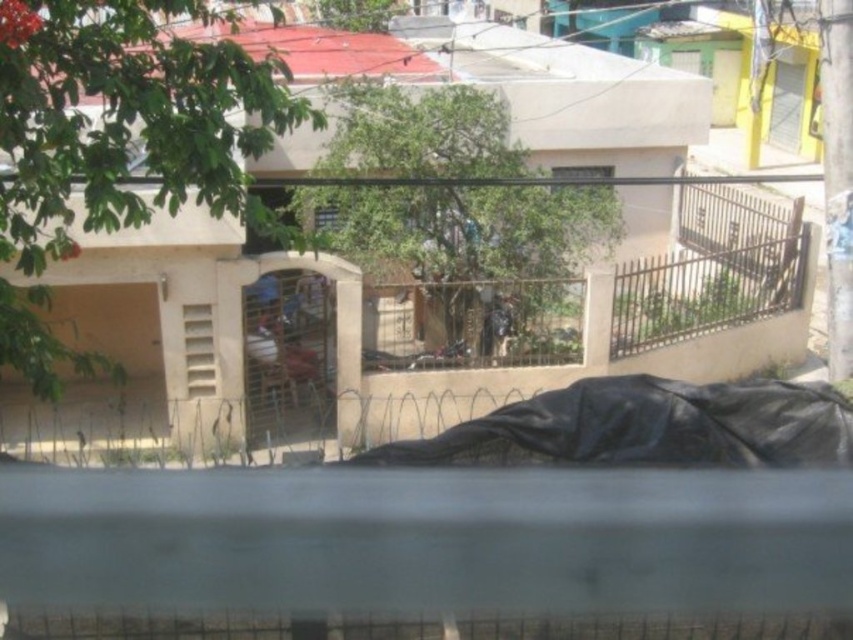
Which is more to the left, black tarp at center or metallic wire cage at center?

Positioned to the left is metallic wire cage at center.

Which is behind, point (744, 438) or point (283, 321)?

Point (283, 321)

You are a GUI agent. You are given a task and a screenshot of the screen. Output one action in this format:
    pyautogui.click(x=<x>, y=<y>)
    Task: Click on the black tarp at center
    Image resolution: width=853 pixels, height=640 pixels.
    Given the screenshot: What is the action you would take?
    (x=643, y=428)